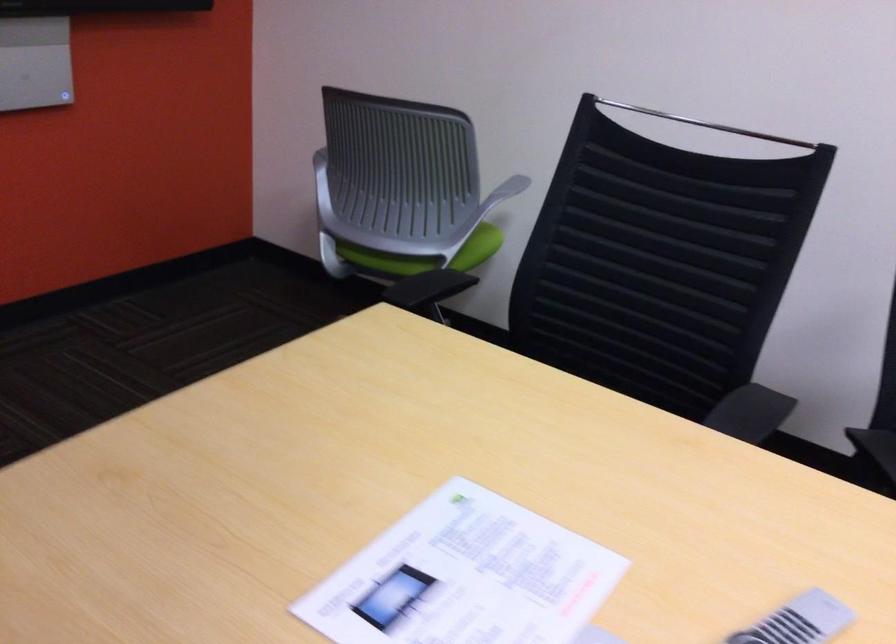
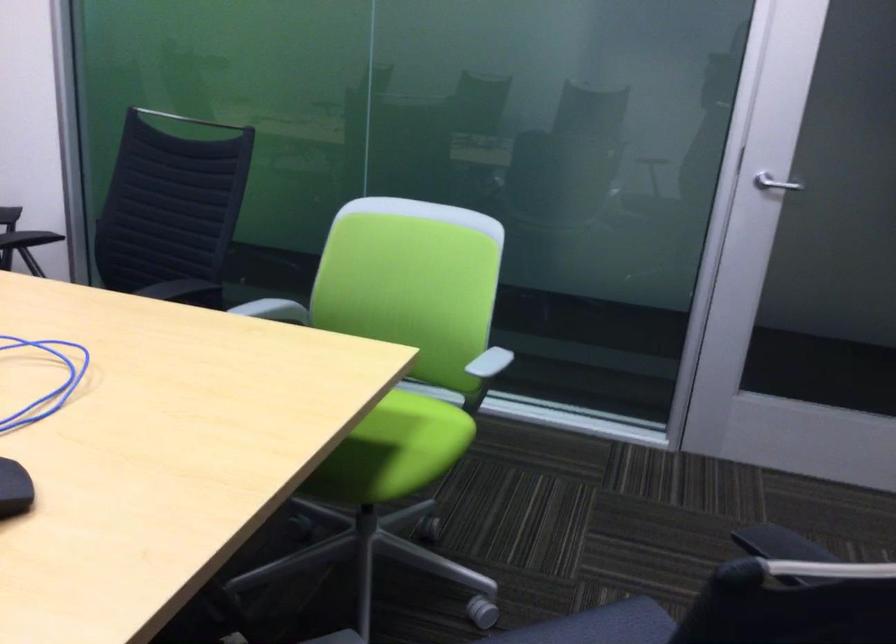
What movement of the cameraman would produce the second image?

The cameraman moved toward right, backward.